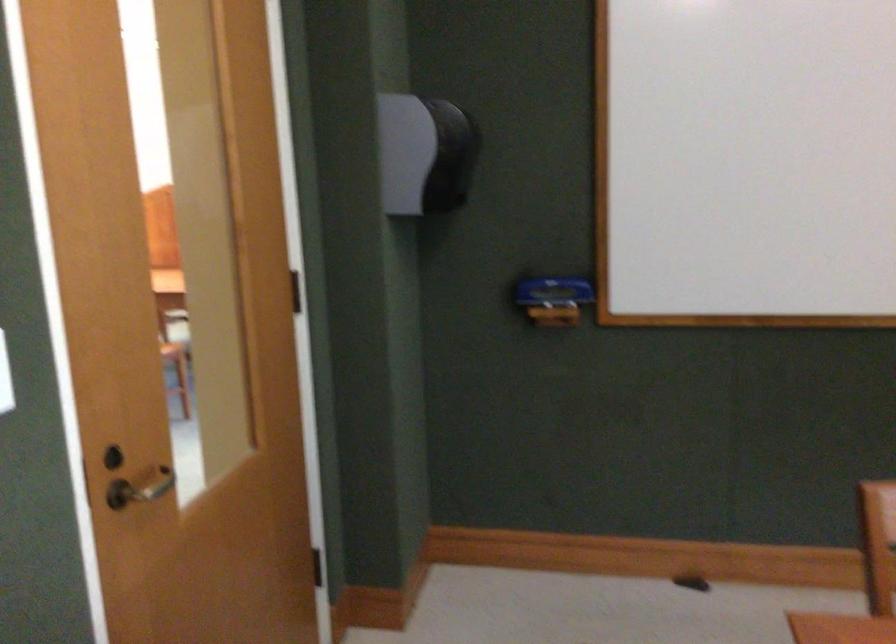
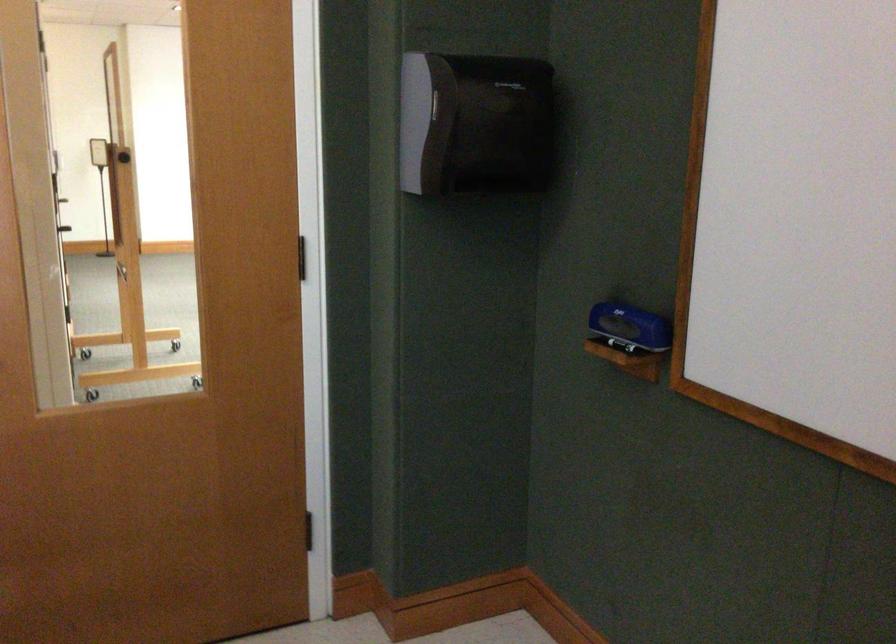
Find the pixel in the second image that matches the point at 572,292 in the first image.

(630, 327)